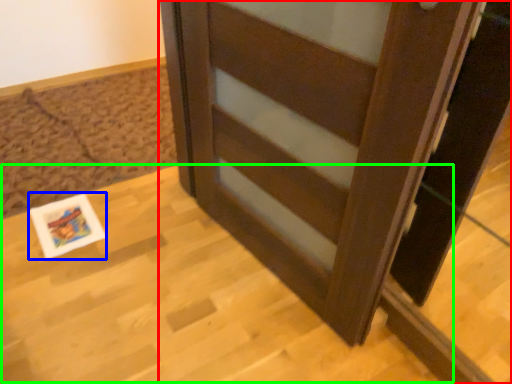
Question: Which object is positioned farthest from furniture (highlighted by a red box)? Select from postcard (highlighted by a blue box) and table (highlighted by a green box).

Choices:
 (A) postcard
 (B) table

Answer: (A)